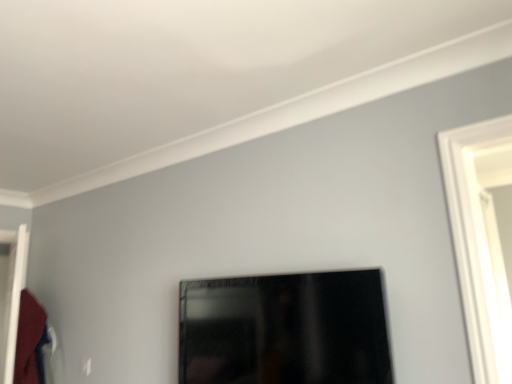
Question: Is velvet red robe at left located outside white glossy door at left?

Choices:
 (A) no
 (B) yes

Answer: (B)

Question: Is velvet red robe at left thinner than white glossy door at left?

Choices:
 (A) no
 (B) yes

Answer: (A)

Question: Can you confirm if velvet red robe at left is wider than white glossy door at left?

Choices:
 (A) no
 (B) yes

Answer: (B)

Question: From the image's perspective, is velvet red robe at left over white glossy door at left?

Choices:
 (A) yes
 (B) no

Answer: (B)

Question: Considering the relative positions of velvet red robe at left and white glossy door at left in the image provided, is velvet red robe at left to the left of white glossy door at left from the viewer's perspective?

Choices:
 (A) no
 (B) yes

Answer: (A)

Question: From the image's perspective, is matte black picture frame at center above or below velvet red robe at left?

Choices:
 (A) above
 (B) below

Answer: (A)

Question: Looking at their shapes, would you say matte black picture frame at center is wider or thinner than velvet red robe at left?

Choices:
 (A) thin
 (B) wide

Answer: (A)

Question: In terms of size, does matte black picture frame at center appear bigger or smaller than velvet red robe at left?

Choices:
 (A) small
 (B) big

Answer: (B)

Question: Is matte black picture frame at center situated inside velvet red robe at left or outside?

Choices:
 (A) inside
 (B) outside

Answer: (B)

Question: Would you say velvet red robe at left is to the left or to the right of matte black picture frame at center in the picture?

Choices:
 (A) right
 (B) left

Answer: (B)

Question: Based on their sizes in the image, would you say velvet red robe at left is bigger or smaller than matte black picture frame at center?

Choices:
 (A) small
 (B) big

Answer: (A)

Question: From a real-world perspective, is velvet red robe at left positioned above or below matte black picture frame at center?

Choices:
 (A) below
 (B) above

Answer: (A)

Question: Is velvet red robe at left taller or shorter than matte black picture frame at center?

Choices:
 (A) short
 (B) tall

Answer: (B)

Question: From a real-world perspective, is matte black picture frame at center physically located above or below white glossy door at left?

Choices:
 (A) below
 (B) above

Answer: (A)

Question: Visually, is matte black picture frame at center positioned to the left or to the right of white glossy door at left?

Choices:
 (A) left
 (B) right

Answer: (B)